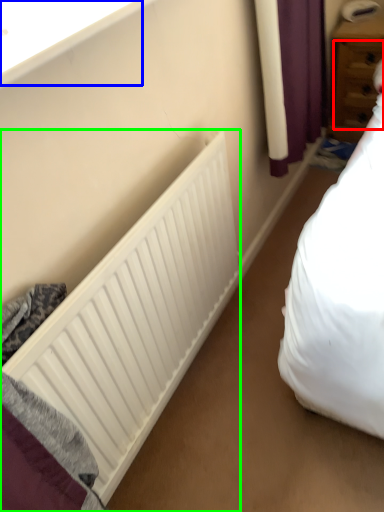
Question: Based on their relative distances, which object is farther from drawer (highlighted by a red box)? Choose from window sill (highlighted by a blue box) and radiator (highlighted by a green box).

Choices:
 (A) window sill
 (B) radiator

Answer: (A)